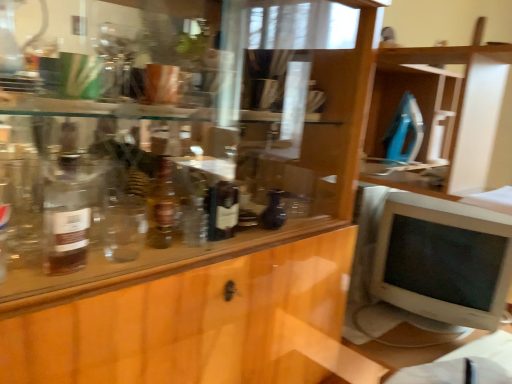
Question: Does white plastic monitor at right have a larger size compared to translucent glass bottle at left, which is counted as the first bottle, starting from the front?

Choices:
 (A) yes
 (B) no

Answer: (A)

Question: Does white plastic monitor at right have a smaller size compared to translucent glass bottle at left, acting as the 2th bottle starting from the right?

Choices:
 (A) no
 (B) yes

Answer: (A)

Question: From a real-world perspective, is white plastic monitor at right positioned under translucent glass bottle at left, the 1th bottle when ordered from left to right, based on gravity?

Choices:
 (A) no
 (B) yes

Answer: (B)

Question: From the image's perspective, is white plastic monitor at right over translucent glass bottle at left, which is counted as the first bottle, starting from the front?

Choices:
 (A) yes
 (B) no

Answer: (B)

Question: Is white plastic monitor at right turned away from translucent glass bottle at left, which is counted as the second bottle, starting from the back?

Choices:
 (A) no
 (B) yes

Answer: (A)

Question: Would you say translucent glass bottle at left, acting as the 2th bottle starting from the right, is to the left or to the right of matte black vase at center, acting as the 1th bottle starting from the right, in the picture?

Choices:
 (A) left
 (B) right

Answer: (A)

Question: Is translucent glass bottle at left, which is counted as the first bottle, starting from the front, wider or thinner than matte black vase at center, arranged as the second bottle when viewed from the left?

Choices:
 (A) thin
 (B) wide

Answer: (B)

Question: From a real-world perspective, is translucent glass bottle at left, which is counted as the first bottle, starting from the front, above or below matte black vase at center, the second bottle positioned from the front?

Choices:
 (A) above
 (B) below

Answer: (A)

Question: Is translucent glass bottle at left, acting as the 2th bottle starting from the right, taller or shorter than matte black vase at center, which ranks as the 1th bottle in back-to-front order?

Choices:
 (A) tall
 (B) short

Answer: (A)

Question: Is matte black vase at center, the second bottle positioned from the front, wider or thinner than translucent glass bottle at left, the 1th bottle when ordered from left to right?

Choices:
 (A) wide
 (B) thin

Answer: (B)

Question: Is matte black vase at center, which ranks as the 1th bottle in back-to-front order, taller or shorter than translucent glass bottle at left, which is counted as the first bottle, starting from the front?

Choices:
 (A) short
 (B) tall

Answer: (A)

Question: From the image's perspective, is matte black vase at center, arranged as the second bottle when viewed from the left, located above or below translucent glass bottle at left, which is counted as the first bottle, starting from the front?

Choices:
 (A) below
 (B) above

Answer: (A)

Question: Considering the positions of point (260, 218) and point (53, 188), is point (260, 218) closer or farther from the camera than point (53, 188)?

Choices:
 (A) closer
 (B) farther

Answer: (B)

Question: Considering the positions of point (51, 241) and point (382, 259), is point (51, 241) closer or farther from the camera than point (382, 259)?

Choices:
 (A) closer
 (B) farther

Answer: (A)

Question: Is translucent glass bottle at left, which is counted as the first bottle, starting from the front, in front of or behind white plastic monitor at right in the image?

Choices:
 (A) front
 (B) behind

Answer: (A)